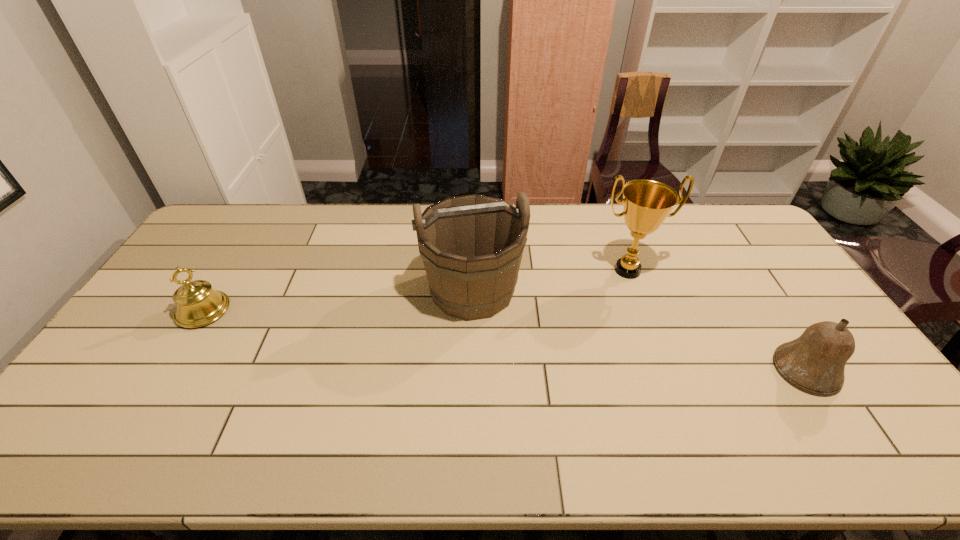
You are a GUI agent. You are given a task and a screenshot of the screen. Output one action in this format:
    pyautogui.click(x=<x>, y=<y>)
    Task: Click on the vacant area between the nearest object and the bucket
    
    Given the screenshot: What is the action you would take?
    pyautogui.click(x=639, y=330)

In order to click on vacant space in between the farther bell and the bucket in this screenshot , I will do click(338, 300).

Find the location of a particular element. The height and width of the screenshot is (540, 960). free space between the nearer bell and the bucket is located at coordinates (x=639, y=330).

Locate an element on the screen. The width and height of the screenshot is (960, 540). free space between the rightmost object and the second object from left to right is located at coordinates (639, 330).

Where is `vacant area that lies between the leftmost object and the second object from right to left`? This screenshot has width=960, height=540. vacant area that lies between the leftmost object and the second object from right to left is located at coordinates (416, 291).

The width and height of the screenshot is (960, 540). Find the location of `free space between the leftmost object and the rightmost object`. free space between the leftmost object and the rightmost object is located at coordinates (504, 340).

The image size is (960, 540). In order to click on vacant area that lies between the second object from left to right and the right bell in this screenshot , I will do 639,330.

I want to click on free space between the nearest object and the farther bell, so click(504, 340).

Find the location of a particular element. The width and height of the screenshot is (960, 540). object that stands as the closest to the third object from left to right is located at coordinates (471, 246).

Identify the location of the second closest object to the rightmost object. coord(471,246).